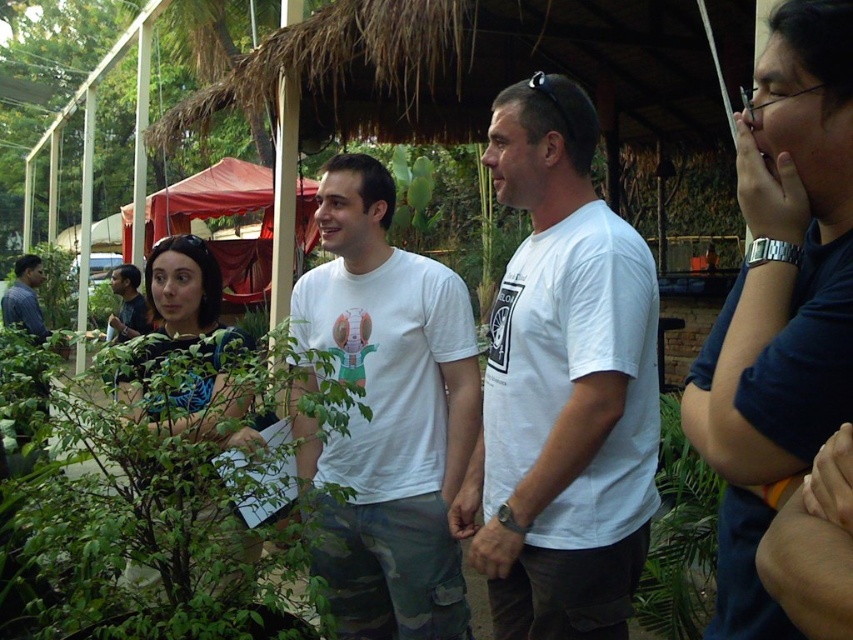
Question: Can you confirm if white t-shirt at center is bigger than dark blue t-shirt at center?

Choices:
 (A) yes
 (B) no

Answer: (A)

Question: Estimate the real-world distances between objects in this image. Which object is farther from the matte white t-shirt at center?

Choices:
 (A) white cotton t-shirt at center
 (B) dark blue t-shirt at center
 (C) white t-shirt at center

Answer: (B)

Question: Does dark blue t-shirt at center have a larger size compared to white cotton t-shirt at center?

Choices:
 (A) yes
 (B) no

Answer: (B)

Question: Which point is closer to the camera?

Choices:
 (A) matte white t-shirt at center
 (B) white t-shirt at center
 (C) dark blue t-shirt at center

Answer: (C)

Question: Which object appears farthest from the camera in this image?

Choices:
 (A) white t-shirt at center
 (B) dark blue t-shirt at center

Answer: (A)

Question: Is white t-shirt at center to the right of dark blue t-shirt at center from the viewer's perspective?

Choices:
 (A) yes
 (B) no

Answer: (B)